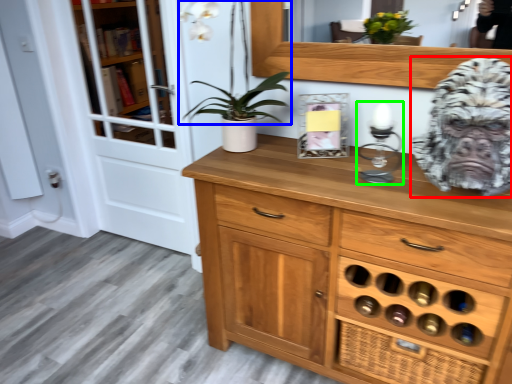
Question: Which object is the farthest from gorilla (highlighted by a red box)? Choose among these: plant (highlighted by a blue box) or candle holder (highlighted by a green box).

Choices:
 (A) plant
 (B) candle holder

Answer: (A)